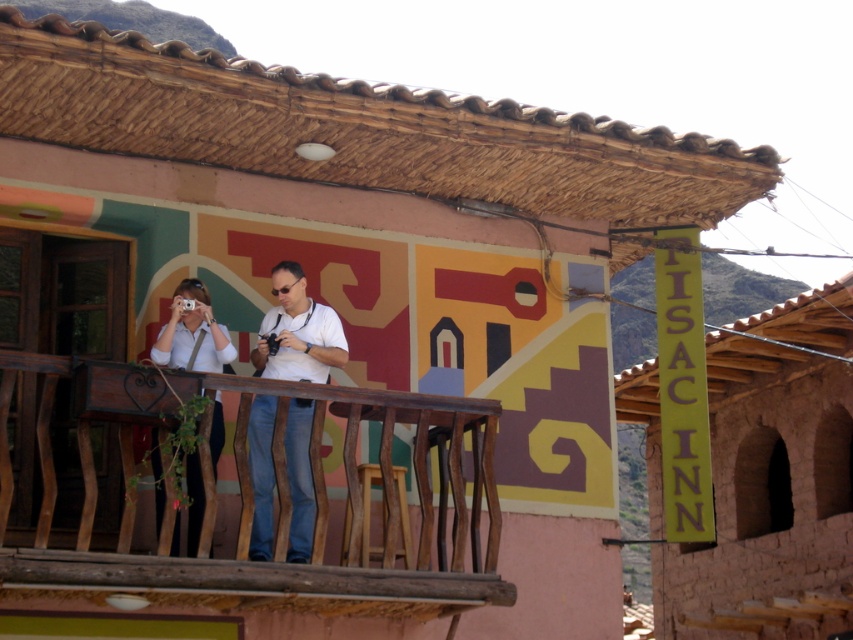
Is point (204, 467) behind point (190, 476)?

No, (204, 467) is closer to viewer.

Who is higher up, brown wooden balcony at center or white matte shirt at left?

white matte shirt at left

Is point (47, 355) positioned in front of point (199, 296)?

Yes, it is in front of point (199, 296).

Find the location of `brown wooden balcony at center`. brown wooden balcony at center is located at coordinates (251, 499).

Who is more distant from viewer, [285,470] or [280,292]?

Point [280,292]

Which is in front, point (283, 531) or point (276, 288)?

Point (283, 531) is more forward.

Is point (49, 474) farther from viewer compared to point (289, 403)?

No, (49, 474) is in front of (289, 403).

Find the location of `brown wooden balcony at center`. brown wooden balcony at center is located at coordinates pyautogui.click(x=251, y=499).

Between white matte shirt at center and white matte shirt at left, which one appears on the left side from the viewer's perspective?

white matte shirt at left

Looking at this image, is white matte shirt at center smaller than white matte shirt at left?

Actually, white matte shirt at center might be larger than white matte shirt at left.

Who is more forward, (x=299, y=353) or (x=163, y=508)?

Point (x=163, y=508) is more forward.

Find the location of a particular element. Image resolution: width=853 pixels, height=640 pixels. white matte shirt at center is located at coordinates (297, 332).